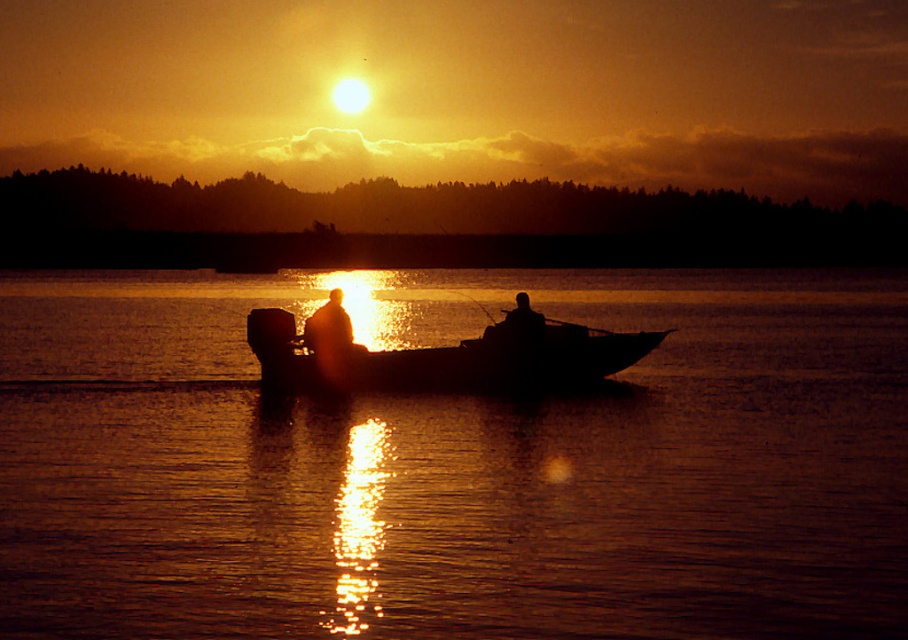
What do you see at coordinates (454, 461) in the screenshot? I see `silky water at center` at bounding box center [454, 461].

Identify the location of silky water at center. (454, 461).

Who is more distant from viewer, (719, 557) or (306, 352)?

Positioned behind is point (306, 352).

This screenshot has width=908, height=640. I want to click on silky water at center, so click(x=454, y=461).